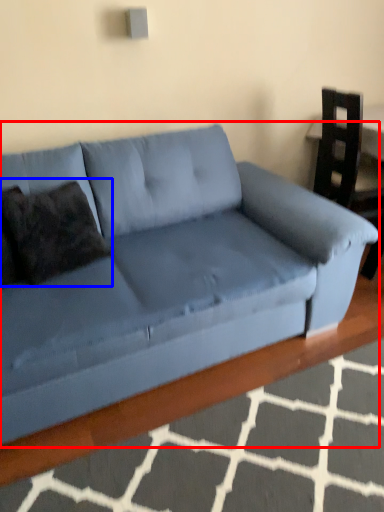
Question: Which object appears closest to the camera in this image, studio couch (highlighted by a red box) or pillow (highlighted by a blue box)?

Choices:
 (A) studio couch
 (B) pillow

Answer: (A)